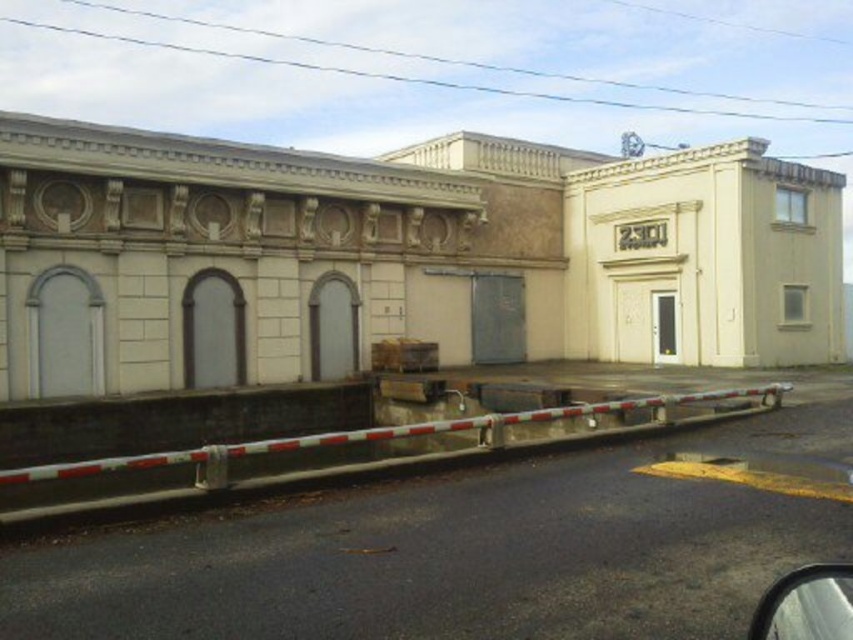
Is white metallic barricade at lower center to the right of metallic silver mirror at lower right from the viewer's perspective?

In fact, white metallic barricade at lower center is to the left of metallic silver mirror at lower right.

What do you see at coordinates (378, 448) in the screenshot? I see `white metallic barricade at lower center` at bounding box center [378, 448].

Where is `white metallic barricade at lower center`? The image size is (853, 640). white metallic barricade at lower center is located at coordinates (378, 448).